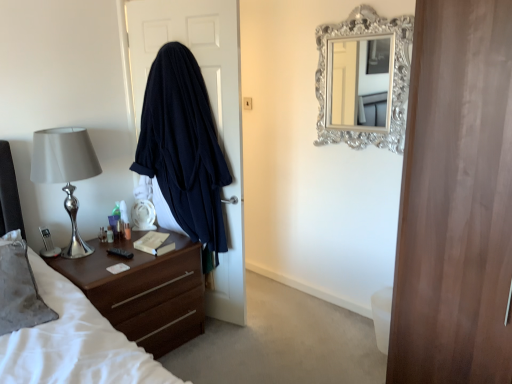
This screenshot has height=384, width=512. Find the location of `free point behind black plastic remote control at left`. free point behind black plastic remote control at left is located at coordinates (117, 252).